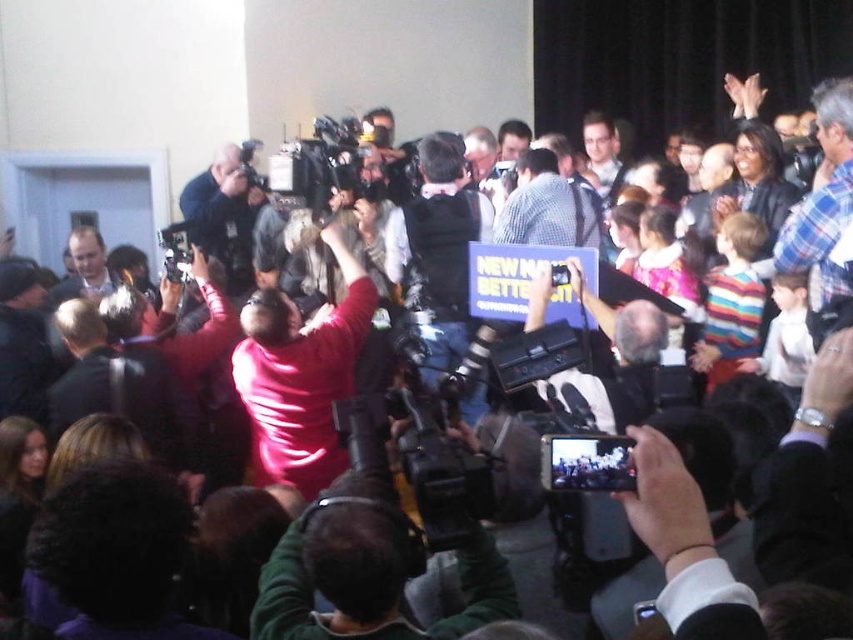
Who is positioned more to the left, matte pink shirt at center or black plastic video camera at center?

Positioned to the left is matte pink shirt at center.

Who is taller, matte pink shirt at center or black plastic video camera at center?

matte pink shirt at center

Does point (347, 376) come farther from viewer compared to point (578, 481)?

That is True.

The height and width of the screenshot is (640, 853). What are the coordinates of `matte pink shirt at center` in the screenshot? It's located at (300, 376).